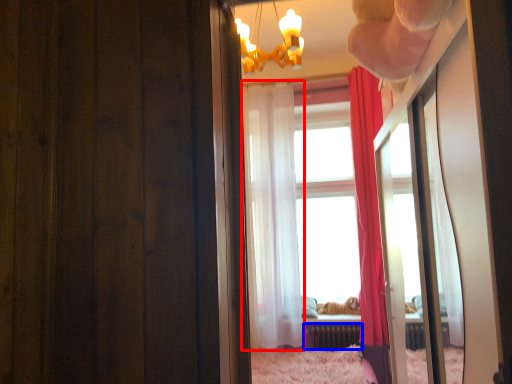
Question: Which object is closer to the camera taking this photo, curtain (highlighted by a red box) or radiator (highlighted by a blue box)?

Choices:
 (A) curtain
 (B) radiator

Answer: (A)